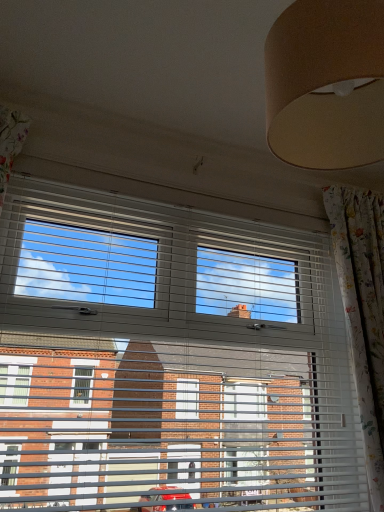
Question: From their relative heights in the image, would you say white plastic blinds at center is taller or shorter than floral fabric curtain at right?

Choices:
 (A) tall
 (B) short

Answer: (B)

Question: Would you say white plastic blinds at center is to the left or to the right of floral fabric curtain at right in the picture?

Choices:
 (A) left
 (B) right

Answer: (A)

Question: From a real-world perspective, is white plastic blinds at center positioned above or below floral fabric curtain at right?

Choices:
 (A) above
 (B) below

Answer: (B)

Question: Is point (352, 310) closer or farther from the camera than point (185, 237)?

Choices:
 (A) farther
 (B) closer

Answer: (A)

Question: Looking at the image, does floral fabric curtain at right seem bigger or smaller compared to white plastic blinds at center?

Choices:
 (A) big
 (B) small

Answer: (B)

Question: In terms of height, does floral fabric curtain at right look taller or shorter compared to white plastic blinds at center?

Choices:
 (A) short
 (B) tall

Answer: (B)

Question: Relative to white plastic blinds at center, is floral fabric curtain at right in front or behind?

Choices:
 (A) front
 (B) behind

Answer: (B)